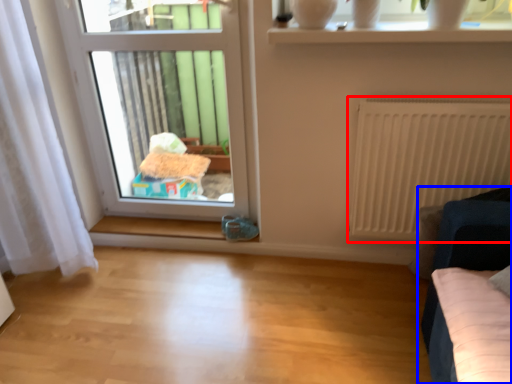
Question: Which of the following is the farthest to the observer, radiator (highlighted by a red box) or furniture (highlighted by a blue box)?

Choices:
 (A) radiator
 (B) furniture

Answer: (A)